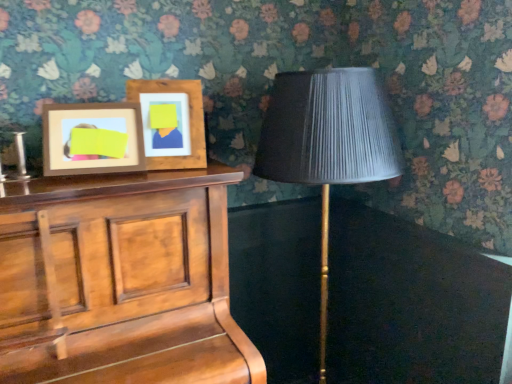
Question: From a real-world perspective, relative to matte black lampshade at right, is wooden picture frame at upper left, placed as the 1th picture frame when sorted from right to left, vertically above or below?

Choices:
 (A) below
 (B) above

Answer: (B)

Question: Visually, is wooden picture frame at upper left, which ranks as the 2th picture frame in left-to-right order, positioned to the left or to the right of matte black lampshade at right?

Choices:
 (A) right
 (B) left

Answer: (B)

Question: Which of these objects is positioned farthest from the wooden picture frame at upper left, acting as the 2th picture frame starting from the right?

Choices:
 (A) wooden piano at left
 (B) wooden picture frame at upper left, placed as the 1th picture frame when sorted from right to left
 (C) matte black lampshade at right

Answer: (C)

Question: Which is nearer to the wooden picture frame at upper left, the first picture frame positioned from the left?

Choices:
 (A) matte black lampshade at right
 (B) wooden piano at left
 (C) wooden picture frame at upper left, which ranks as the 2th picture frame in left-to-right order

Answer: (C)